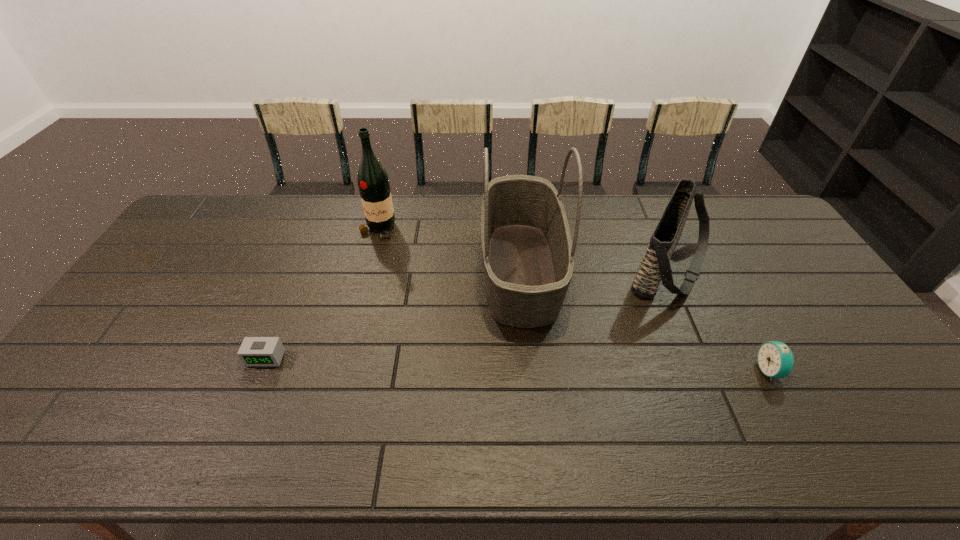
Locate an element on the screen. This screenshot has height=540, width=960. free space located on the front of the third shortest object is located at coordinates (710, 359).

I want to click on blank area located 0.080m on the front-facing side of the second shortest object, so [728, 370].

Find the location of `blank space located 0.310m on the front-facing side of the second shortest object`. blank space located 0.310m on the front-facing side of the second shortest object is located at coordinates (638, 370).

Locate an element on the screen. This screenshot has height=540, width=960. vacant space situated 0.070m on the front-facing side of the second shortest object is located at coordinates (732, 370).

Find the location of a particular element. The image size is (960, 540). vacant space situated on the front-facing side of the leftmost object is located at coordinates point(245,409).

At what (x,y) coordinates should I click in order to perform the action: click on basket situated at the far edge. Please return your answer as a coordinate pair (x, y). The height and width of the screenshot is (540, 960). Looking at the image, I should click on (527, 250).

This screenshot has height=540, width=960. I want to click on wine bottle that is at the far edge, so click(373, 182).

Locate an element on the screen. The image size is (960, 540). handbag that is at the far edge is located at coordinates (655, 266).

The width and height of the screenshot is (960, 540). In the image, there is a desktop. What are the coordinates of `free space at the far edge` in the screenshot? It's located at (440, 206).

The width and height of the screenshot is (960, 540). I want to click on free space at the near edge of the desktop, so click(x=160, y=432).